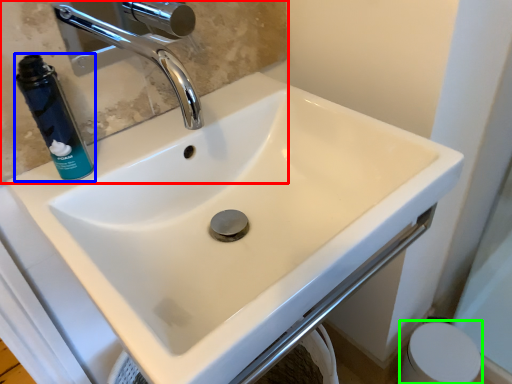
Question: Estimate the real-world distances between objects in this image. Which object is farther from mirror (highlighted by a red box), mouthwash (highlighted by a blue box) or toilet paper (highlighted by a green box)?

Choices:
 (A) mouthwash
 (B) toilet paper

Answer: (B)